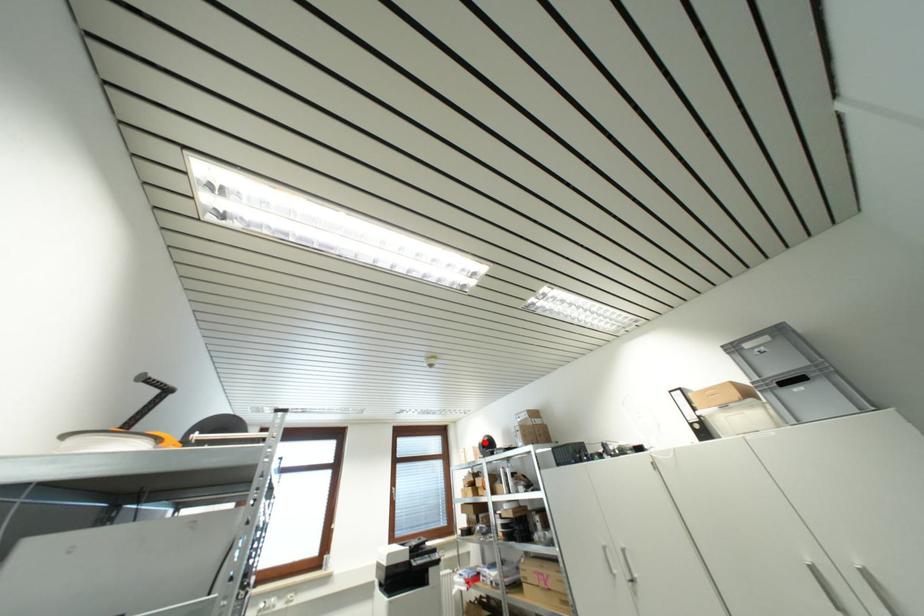
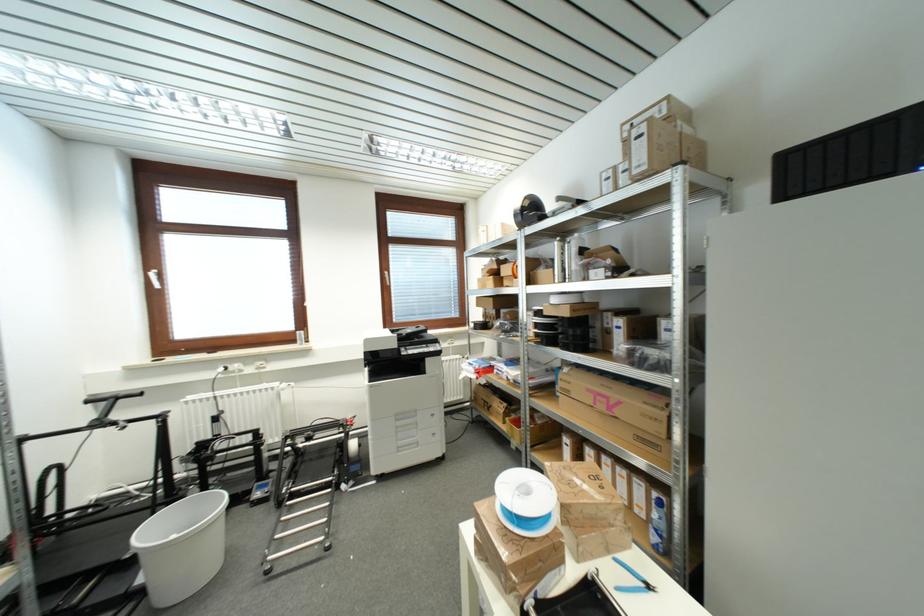
Find the pixel in the second image that matches the highlighted location in the first image.

(523, 207)